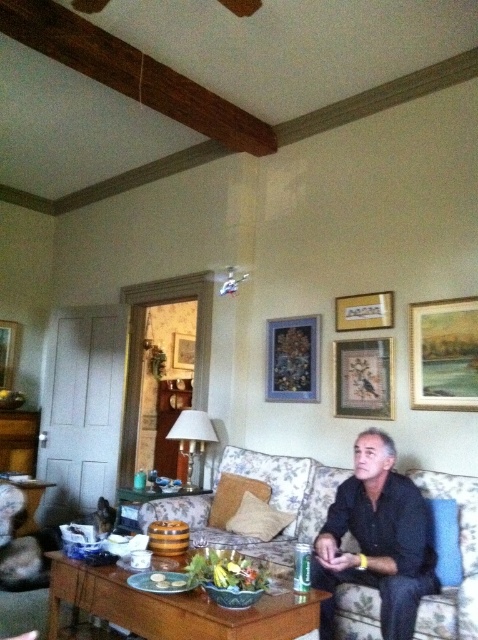
What object is located at the coordinate point (270, 500) in the image?

The point (270, 500) corresponds to the floral fabric couch at center.

You are standing in the living room and want to place a tray on the coffee table. To do this, you need to walk around the floral fabric couch at center. Which direction should you move relative to the couch to reach the coffee table?

The floral fabric couch at center is located at point (270, 500), so to reach the coffee table, you should move towards the lower center area where the coffee table is positioned, going around the couch either to the left or right side depending on your starting position.